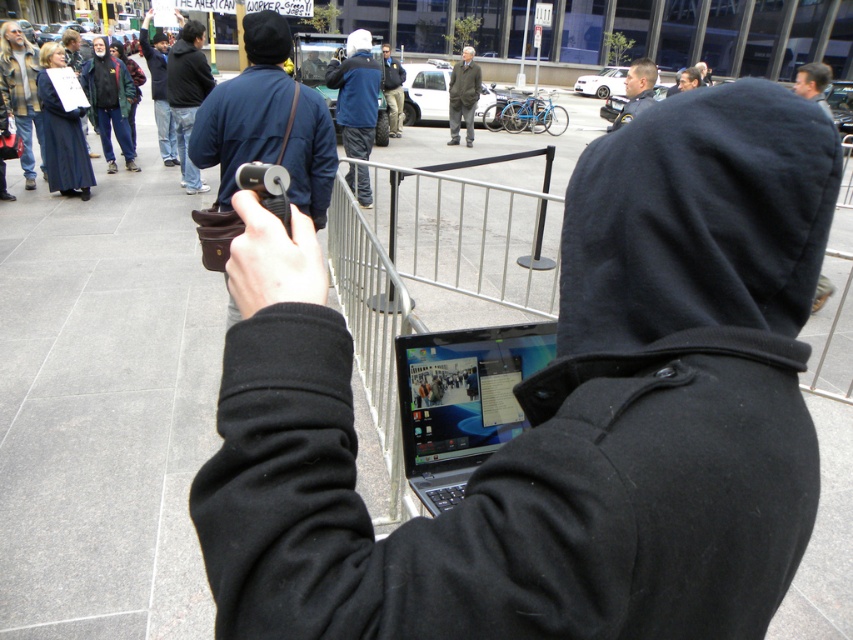
Is gray wool coat at center smaller than dark blue jacket at center?

Actually, gray wool coat at center might be larger than dark blue jacket at center.

Who is more distant from viewer, (454, 109) or (393, 80)?

Positioned behind is point (454, 109).

The height and width of the screenshot is (640, 853). I want to click on gray wool coat at center, so tap(463, 96).

At what (x,y) coordinates should I click in order to perform the action: click on gray wool coat at center. Please return your answer as a coordinate pair (x, y). Looking at the image, I should click on (463, 96).

Measure the distance between black fleece hoodie at center and light brown uniform at center.

black fleece hoodie at center is 4.12 feet away from light brown uniform at center.

Is black fleece hoodie at center positioned in front of light brown uniform at center?

Yes, black fleece hoodie at center is closer to the viewer.

Which is behind, point (558, 324) or point (619, 118)?

The point (619, 118) is more distant.

The width and height of the screenshot is (853, 640). Identify the location of black fleece hoodie at center. (556, 412).

Can you confirm if dark blue hoodie at upper center is positioned to the right of dark blue jacket at center?

Incorrect, dark blue hoodie at upper center is not on the right side of dark blue jacket at center.

The width and height of the screenshot is (853, 640). Describe the element at coordinates (160, 88) in the screenshot. I see `dark blue hoodie at upper center` at that location.

The height and width of the screenshot is (640, 853). What are the coordinates of `dark blue hoodie at upper center` in the screenshot? It's located at (160, 88).